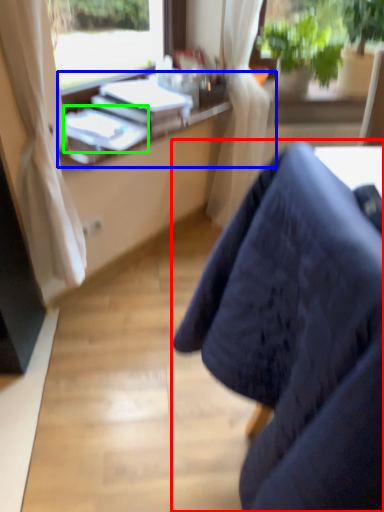
Question: Based on their relative distances, which object is nearer to chair (highlighted by a red box)? Choose from desk (highlighted by a blue box) and book (highlighted by a green box).

Choices:
 (A) desk
 (B) book

Answer: (B)